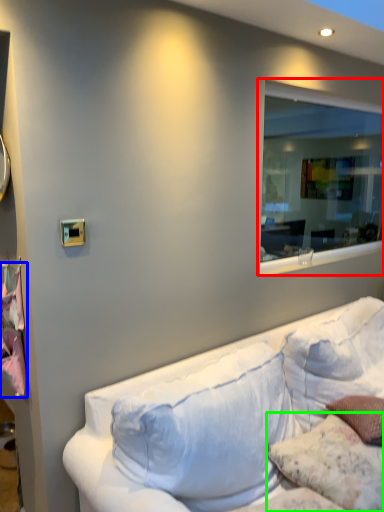
Question: Considering the real-world distances, which object is closest to window (highlighted by a red box)? sheet (highlighted by a blue box) or pillow (highlighted by a green box).

Choices:
 (A) sheet
 (B) pillow

Answer: (B)